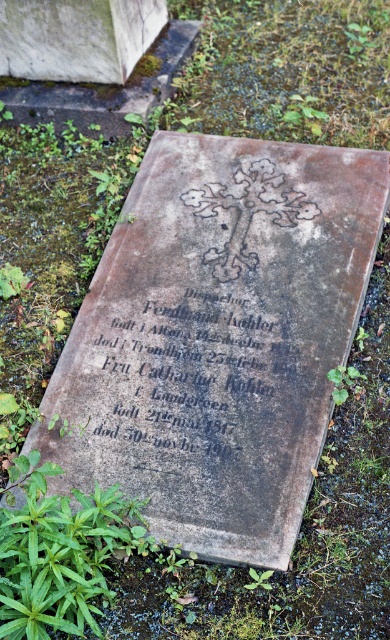
Based on the photo, does gray stone gravestone at center appear over green leafy weed at lower right?

Correct, gray stone gravestone at center is located above green leafy weed at lower right.

Is the position of gray stone gravestone at center less distant than that of green leafy weed at lower right?

Yes, gray stone gravestone at center is in front of green leafy weed at lower right.

This screenshot has height=640, width=390. I want to click on gray stone gravestone at center, so click(x=216, y=339).

Can you confirm if black stone inscription at center is positioned above green leafy weed at lower center?

Yes.

Can you confirm if black stone inscription at center is positioned to the right of green leafy weed at lower center?

Incorrect, black stone inscription at center is not on the right side of green leafy weed at lower center.

Which is in front, point (232, 360) or point (269, 570)?

Point (269, 570)

This screenshot has height=640, width=390. Find the location of `black stone inscription at center`. black stone inscription at center is located at coordinates (189, 372).

Does gray stone gravestone at center come in front of black stone inscription at center?

Yes, it is.

The height and width of the screenshot is (640, 390). I want to click on gray stone gravestone at center, so click(x=216, y=339).